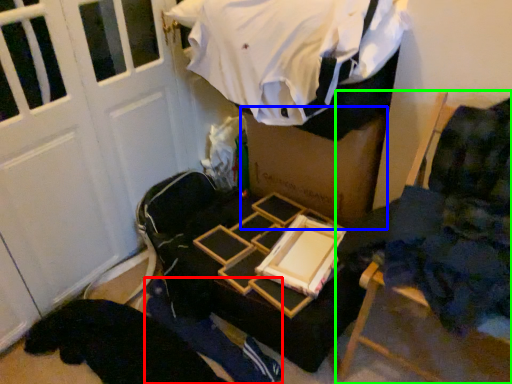
Question: Which object is the farthest from person (highlighted by a red box)? Choose among these: box (highlighted by a blue box) or furniture (highlighted by a green box).

Choices:
 (A) box
 (B) furniture

Answer: (A)